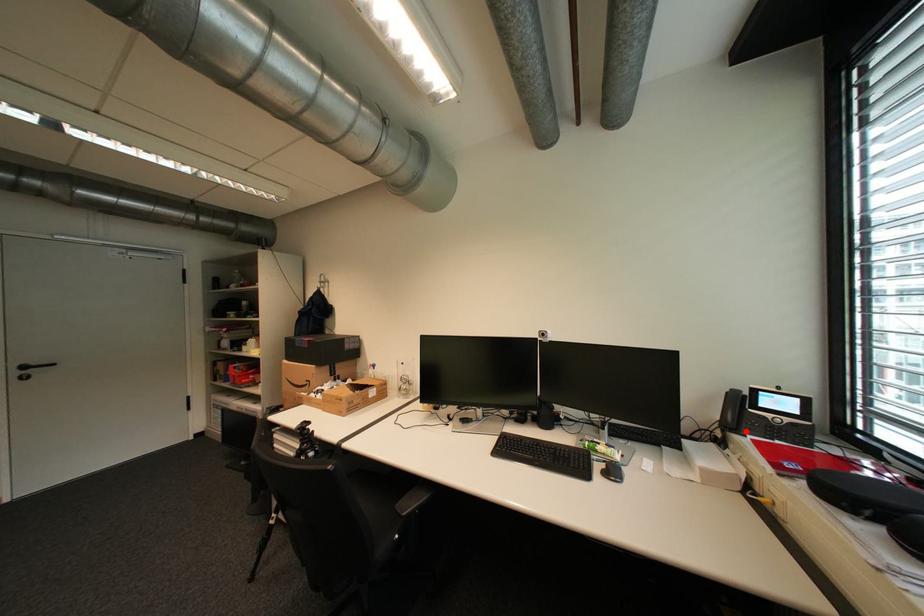
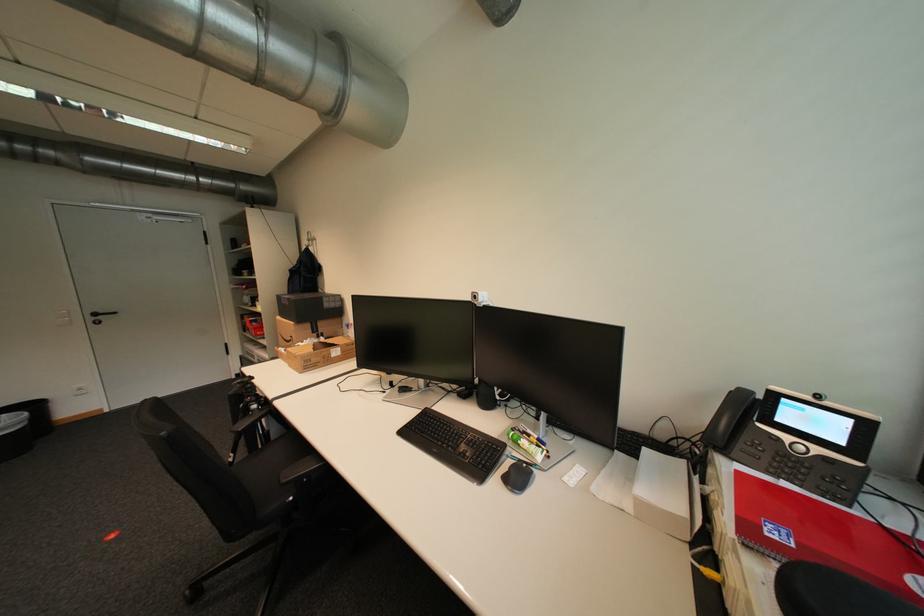
Find the pixel in the second image that matches the highlighted location in the first image.

(734, 453)